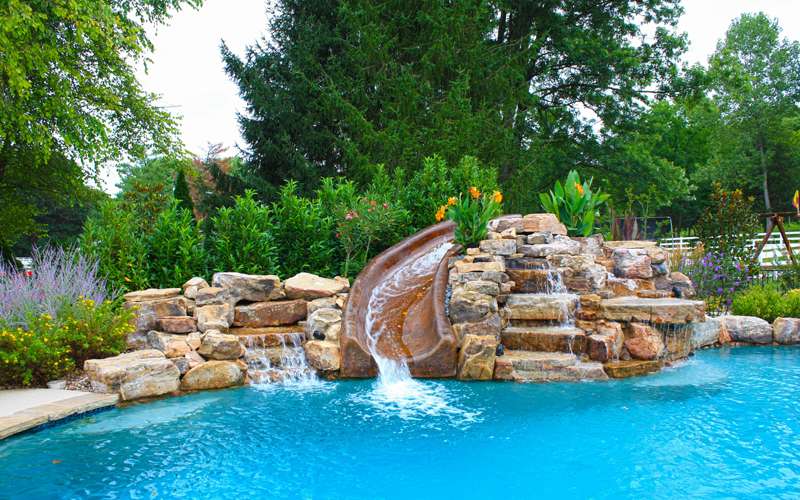
Image resolution: width=800 pixels, height=500 pixels. I want to click on yellow/orange flowers, so click(x=501, y=197), click(x=580, y=187), click(x=476, y=192), click(x=454, y=196), click(x=437, y=220).